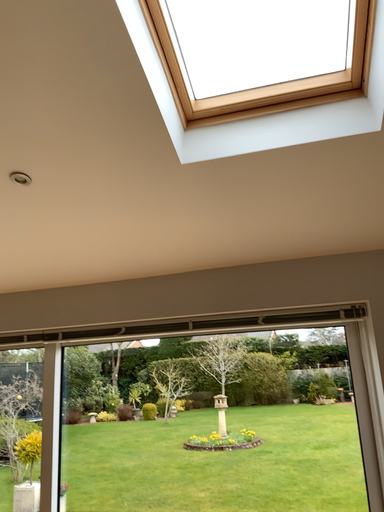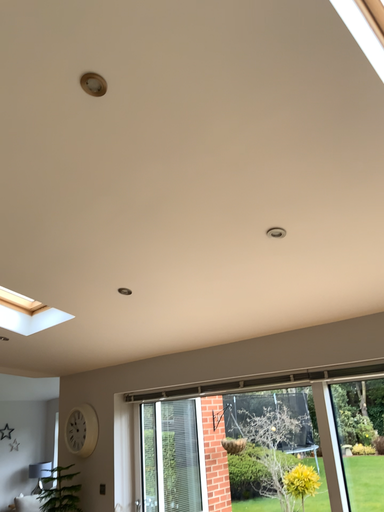
Question: How did the camera likely rotate when shooting the video?

Choices:
 (A) rotated left
 (B) rotated right

Answer: (A)